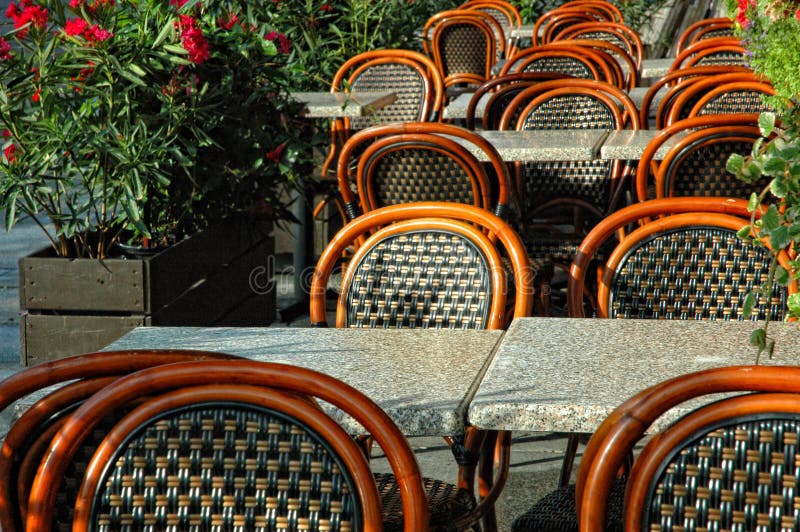
The height and width of the screenshot is (532, 800). Identify the location of table tops. (397, 375), (554, 373), (554, 141), (621, 149), (350, 108), (453, 109), (522, 31), (654, 69), (626, 66), (637, 97).